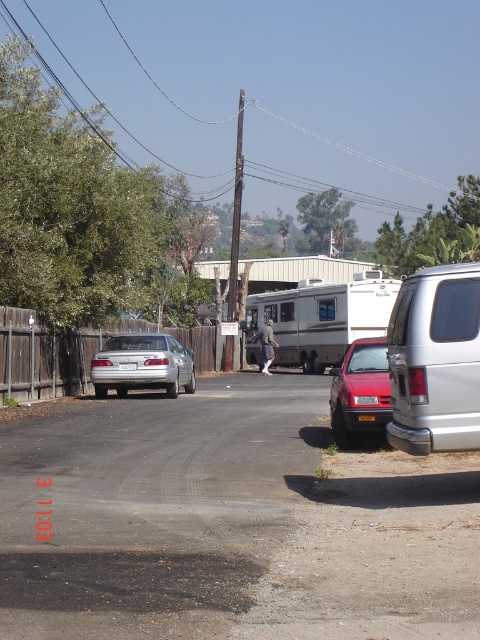
You are a delivery driver trying to park your truck in the space between the silver metallic camper at center and the yellow matte license plate at center. Your truck is 2 meters wide. Can you fit your truck in that space?

The silver metallic camper at center is wider than the yellow matte license plate at center. However, the description only provides information about their relative widths, not the actual space between them. Without knowing the distance between the two objects, it is impossible to determine if the truck can fit.

You are a pedestrian standing at the edge of the road. You notice a metallic red car at right and a yellow matte license plate at center. Which object is nearer to you?

The metallic red car at right is closer to the viewer than the yellow matte license plate at center.